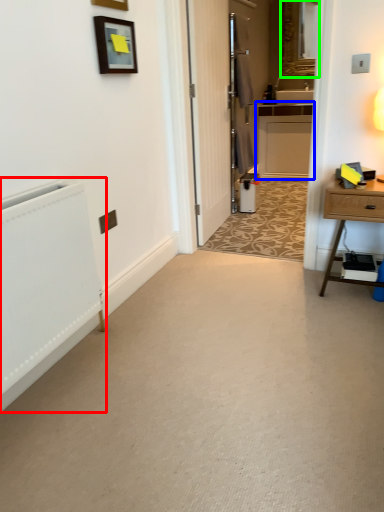
Question: Which object is the closest to the radiator (highlighted by a red box)? Choose among these: cabinetry (highlighted by a blue box) or mirror (highlighted by a green box).

Choices:
 (A) cabinetry
 (B) mirror

Answer: (A)